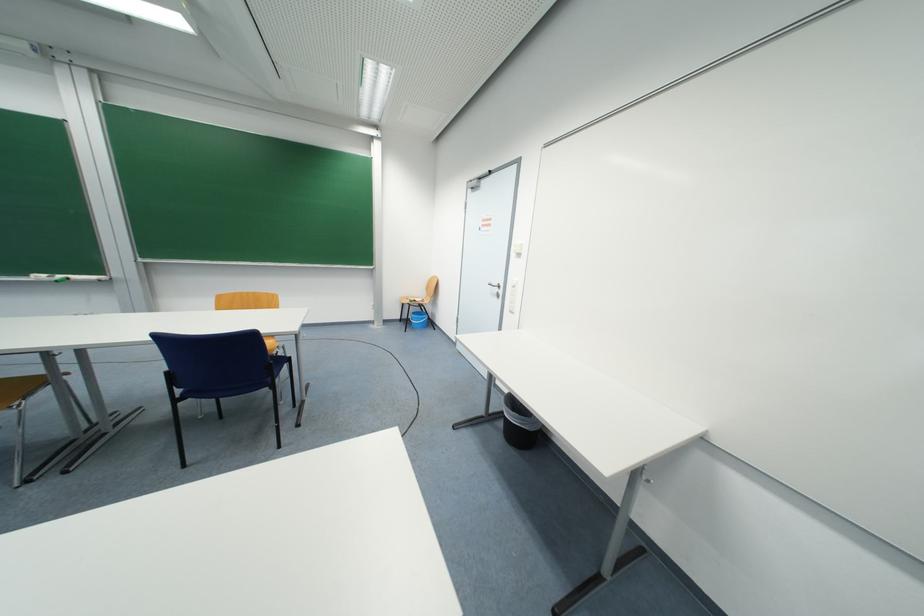
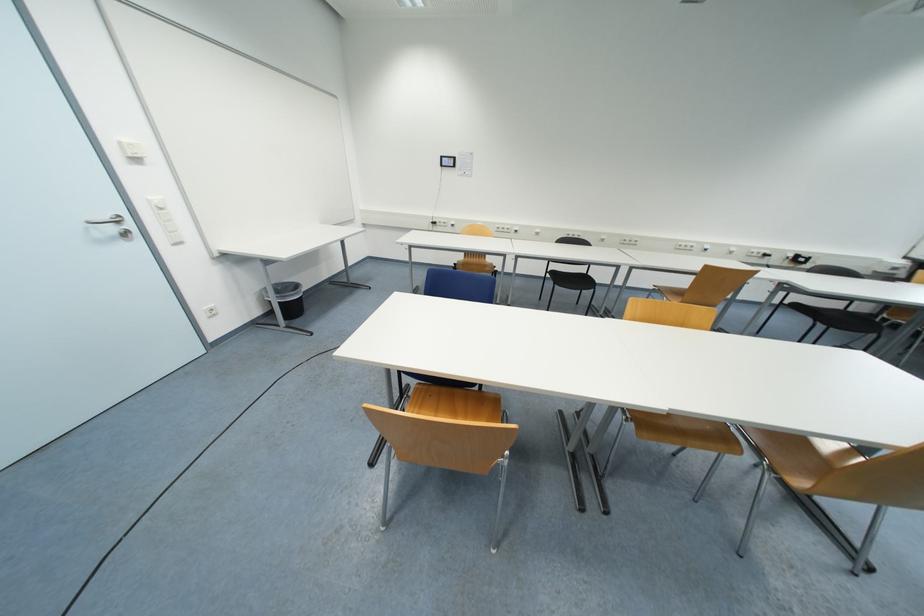
Locate, in the second image, the point that corresponds to (518,288) in the first image.

(166, 211)